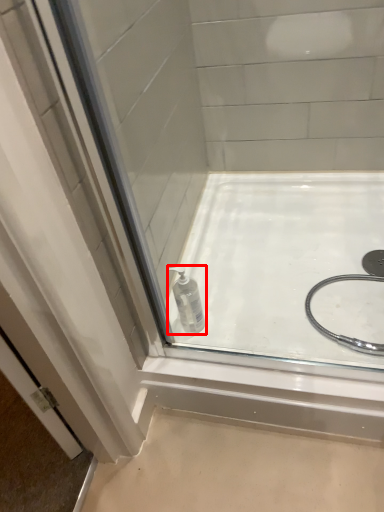
Question: In this image, where is bottle (annotated by the red box) located relative to bath?

Choices:
 (A) right
 (B) left

Answer: (B)